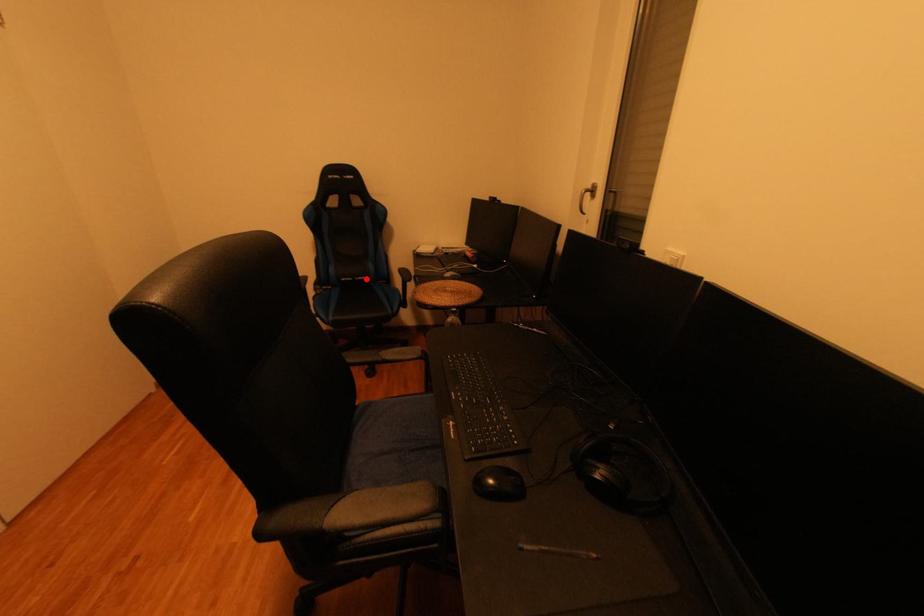
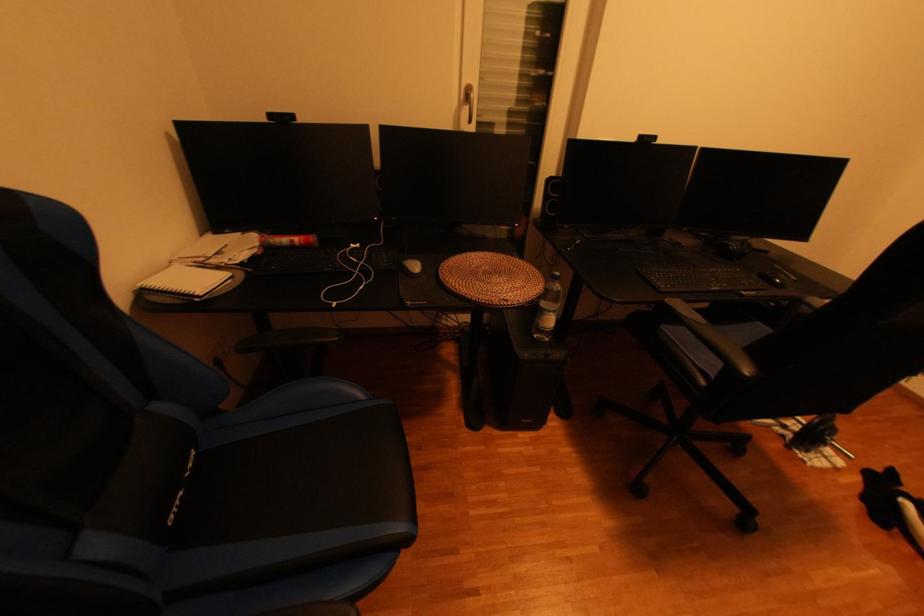
In the second image, find the point that corresponds to the highlighted location in the first image.

(197, 477)